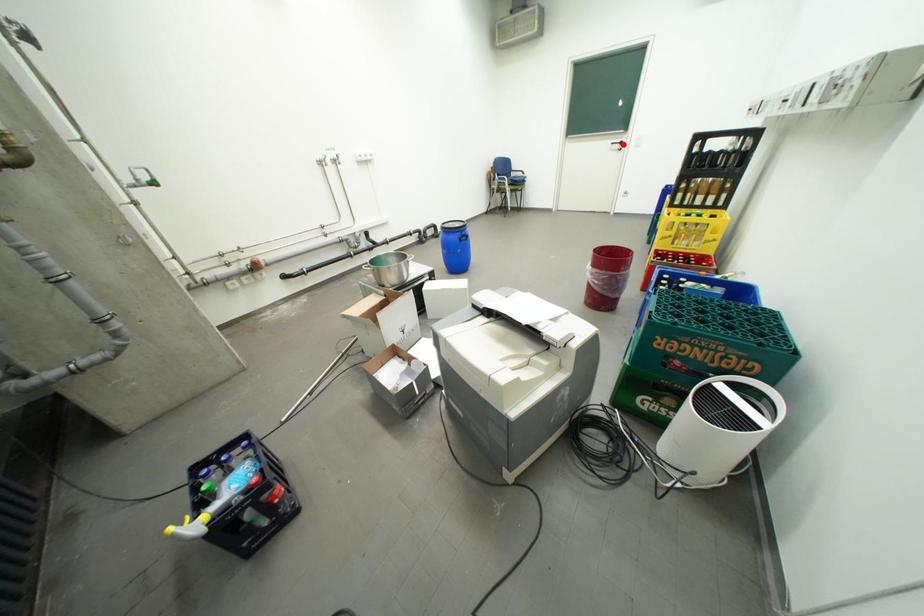
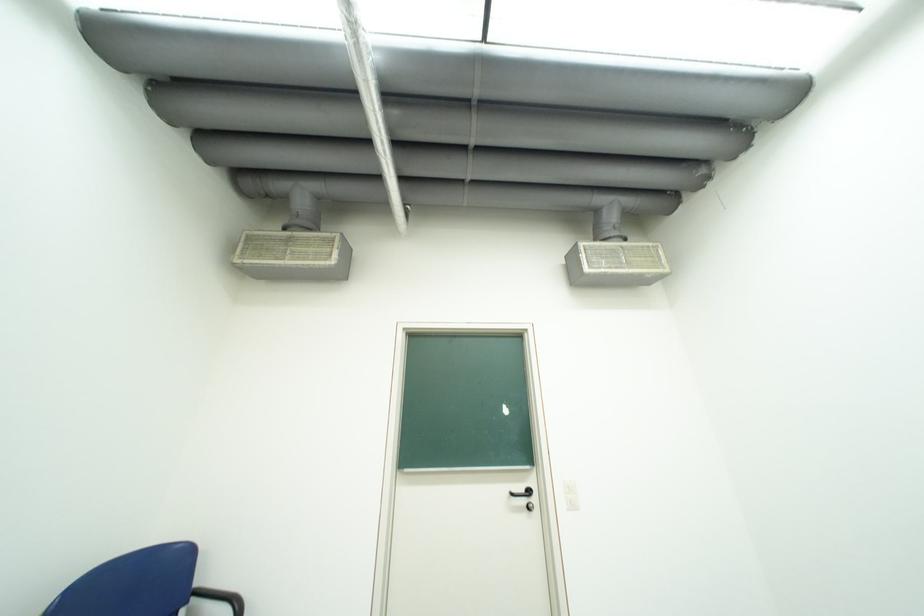
In the second image, find the point that corresponds to the highlighted location in the first image.

(523, 495)